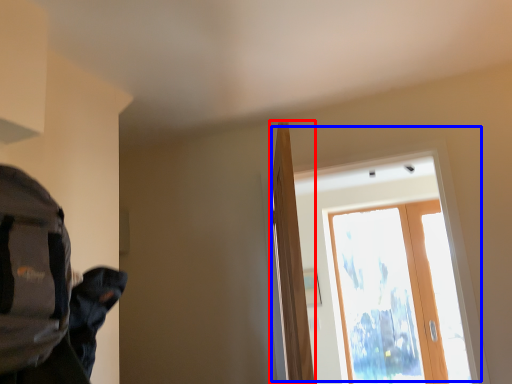
Question: Which point is closer to the camera, door (highlighted by a red box) or window (highlighted by a blue box)?

Choices:
 (A) door
 (B) window

Answer: (A)